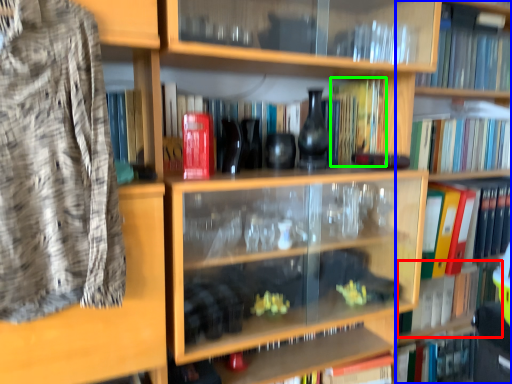
Question: Based on their relative distances, which object is farther from book (highlighted by a red box)? Choose from bookcase (highlighted by a blue box) and book (highlighted by a green box).

Choices:
 (A) bookcase
 (B) book

Answer: (B)